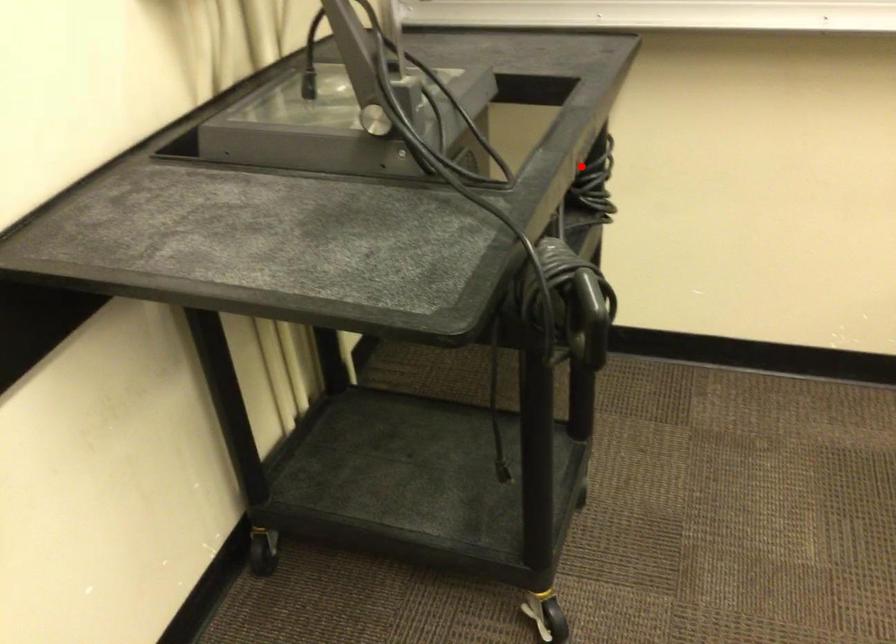
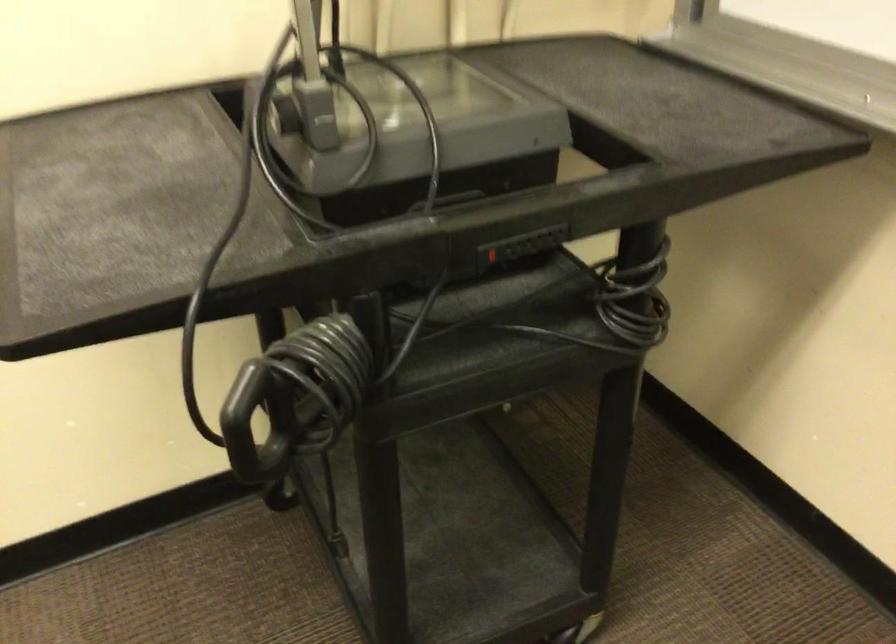
Locate, in the second image, the point that corresponds to the highlighted location in the first image.

(490, 254)